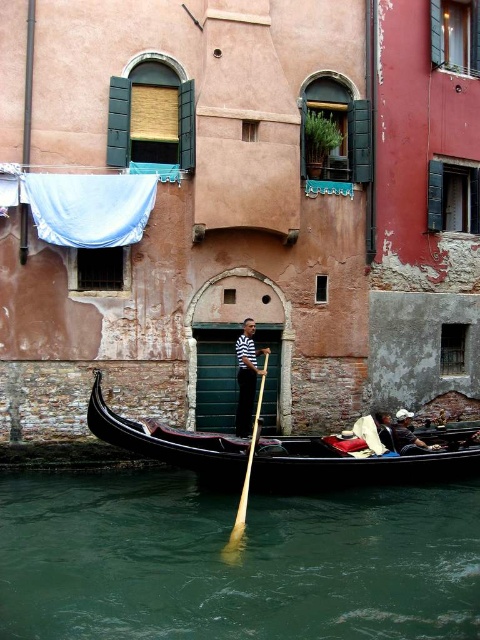
Question: Is green liquid water at lower center below wooden polished paddle at center?

Choices:
 (A) no
 (B) yes

Answer: (B)

Question: Which of these objects is positioned closest to the dark blue fabric at lower right?

Choices:
 (A) black polished wood canoe at lower center
 (B) leather jacket at lower right
 (C) striped cotton shirt at center

Answer: (B)

Question: Can you confirm if green liquid water at lower center is positioned below striped cotton shirt at center?

Choices:
 (A) no
 (B) yes

Answer: (B)

Question: Can you confirm if leather jacket at lower right is positioned to the left of dark blue fabric at lower right?

Choices:
 (A) no
 (B) yes

Answer: (A)

Question: Which object appears farthest from the camera in this image?

Choices:
 (A) striped cotton shirt at center
 (B) leather jacket at lower right
 (C) green liquid water at lower center
 (D) wooden polished paddle at center

Answer: (A)

Question: Which object is closer to the camera taking this photo?

Choices:
 (A) black polished wood canoe at lower center
 (B) striped cotton shirt at center
 (C) green liquid water at lower center
 (D) leather jacket at lower right

Answer: (C)